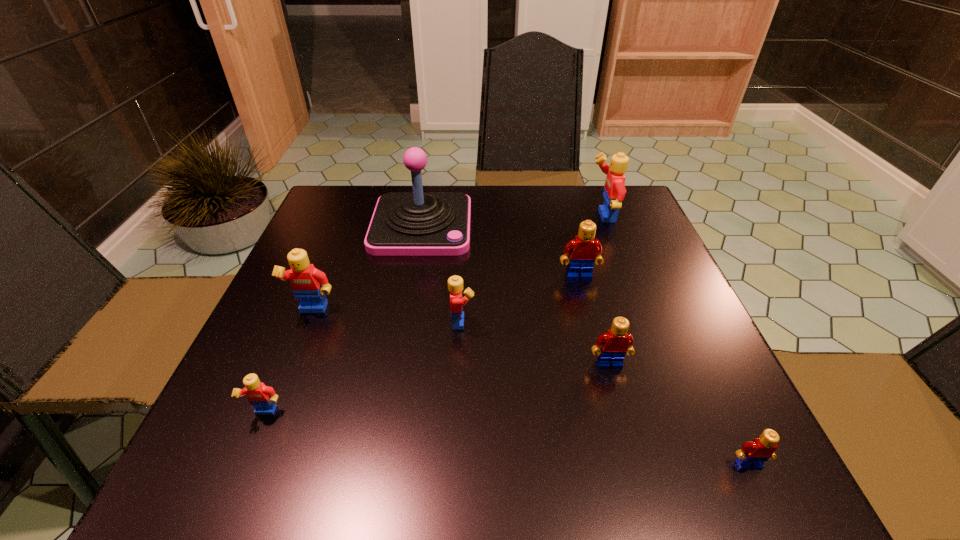
At what (x,y) coordinates should I click in order to perform the action: click on the third closest red Lego to the third smallest yellow Lego. Please return your answer as a coordinate pair (x, y). Looking at the image, I should click on (752, 455).

Locate which red Lego is the second closest to the farthest Lego. Please provide its 2D coordinates. Your answer should be formatted as a tuple, i.e. [(x, y)], where the tuple contains the x and y coordinates of a point satisfying the conditions above.

[(615, 343)]